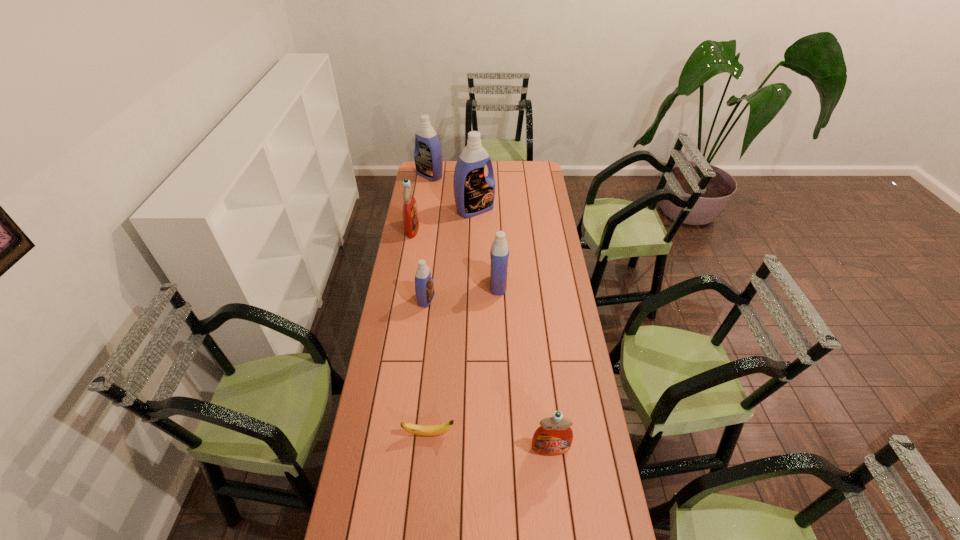
Image resolution: width=960 pixels, height=540 pixels. In order to click on the tallest object in this screenshot , I will do `click(474, 193)`.

In order to click on the biggest blue detergent in this screenshot , I will do `click(474, 193)`.

You are a GUI agent. You are given a task and a screenshot of the screen. Output one action in this format:
    pyautogui.click(x=<x>, y=<y>)
    Task: Click on the third smallest blue detergent
    Image resolution: width=960 pixels, height=540 pixels.
    Given the screenshot: What is the action you would take?
    pyautogui.click(x=428, y=158)

Identify the location of the fifth shortest detergent. This screenshot has height=540, width=960. (428, 158).

In order to click on the left red detergent in this screenshot , I will do `click(410, 211)`.

At what (x,y) coordinates should I click in order to perform the action: click on the bigger red detergent. Please return your answer as a coordinate pair (x, y). This screenshot has width=960, height=540. Looking at the image, I should click on (410, 211).

The height and width of the screenshot is (540, 960). In order to click on the second smallest blue detergent in this screenshot , I will do `click(499, 253)`.

The height and width of the screenshot is (540, 960). I want to click on the smallest blue detergent, so click(424, 287).

You are a GUI agent. You are given a task and a screenshot of the screen. Output one action in this format:
    pyautogui.click(x=<x>, y=<y>)
    Task: Click on the smaller red detergent
    
    Given the screenshot: What is the action you would take?
    pyautogui.click(x=554, y=437)

The height and width of the screenshot is (540, 960). Identify the location of the nearest detergent. (554, 437).